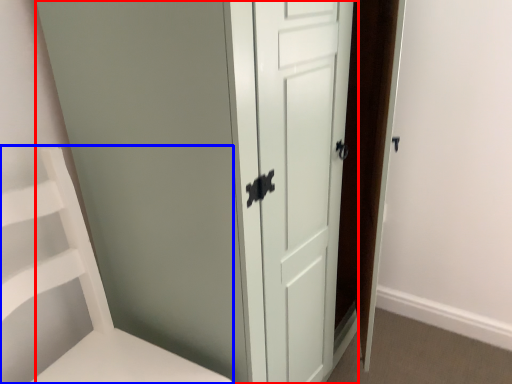
Question: Which object is further to the camera taking this photo, door (highlighted by a red box) or furniture (highlighted by a blue box)?

Choices:
 (A) door
 (B) furniture

Answer: (A)